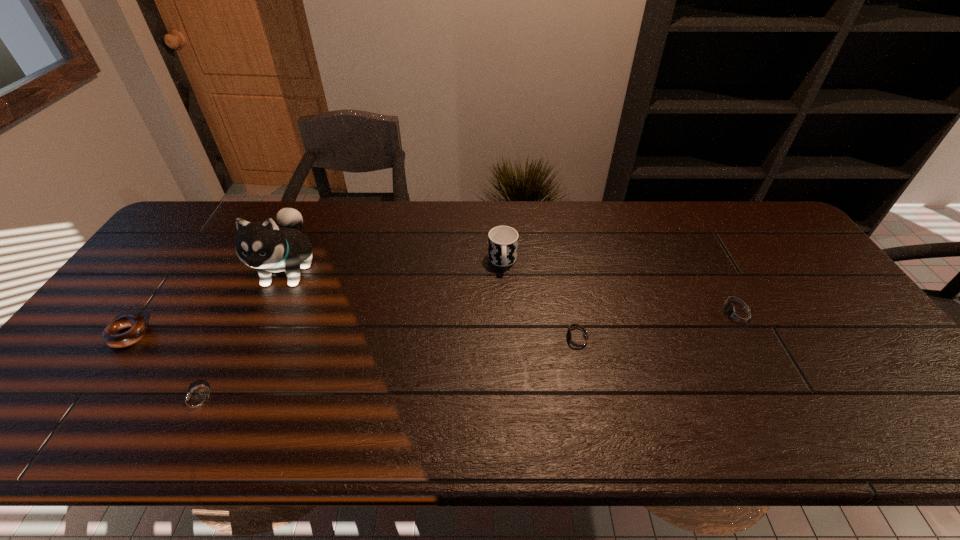
Find the location of a particular element. vacant spot for a new watch to ensure equal spacing is located at coordinates (398, 368).